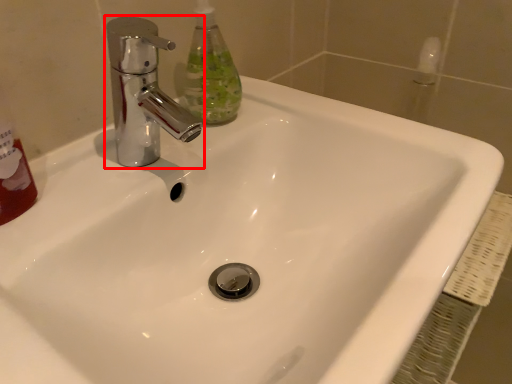
Question: From the image's perspective, what is the correct spatial relationship of tap (annotated by the red box) in relation to cleaning product?

Choices:
 (A) above
 (B) below

Answer: (B)